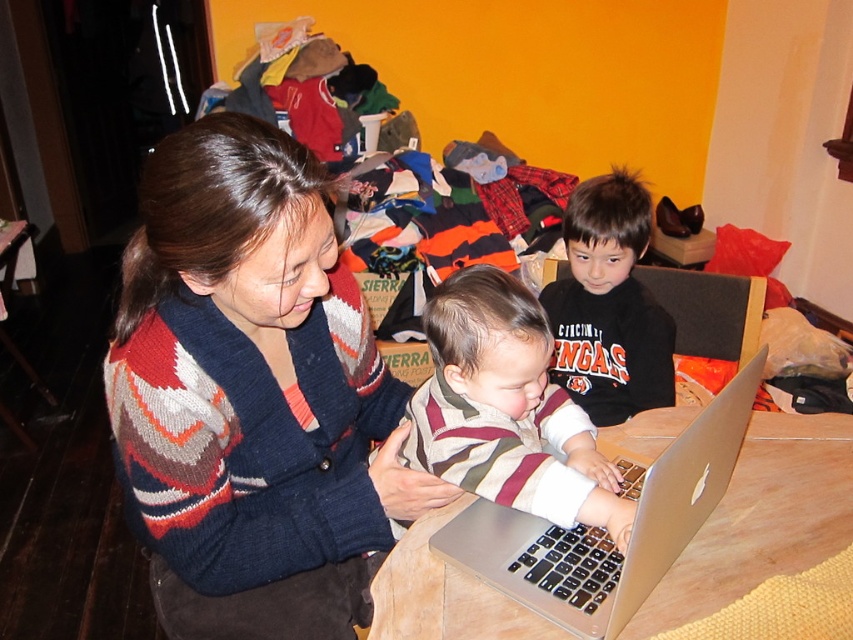
Question: Can you confirm if striped fabric baby at center is positioned to the right of black cotton shirt at center?

Choices:
 (A) no
 (B) yes

Answer: (A)

Question: Which object is closer to the camera taking this photo?

Choices:
 (A) striped fabric baby at center
 (B) dark blue fabric at lower center

Answer: (A)

Question: Does knitted sweater at center have a smaller size compared to silver metallic laptop at center?

Choices:
 (A) no
 (B) yes

Answer: (A)

Question: Is striped fabric baby at center positioned behind silver metallic laptop at center?

Choices:
 (A) no
 (B) yes

Answer: (B)

Question: Which object is positioned closest to the knitted sweater at center?

Choices:
 (A) silver metallic laptop at center
 (B) dark blue fabric at lower center
 (C) striped fabric baby at center
 (D) black cotton shirt at center

Answer: (B)

Question: Which of these objects is positioned farthest from the striped fabric baby at center?

Choices:
 (A) black cotton shirt at center
 (B) knitted sweater at center
 (C) dark blue fabric at lower center

Answer: (A)